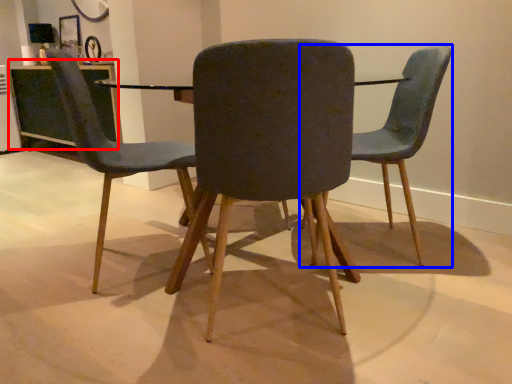
Question: Which point is closer to the camera, table (highlighted by a red box) or chair (highlighted by a blue box)?

Choices:
 (A) table
 (B) chair

Answer: (B)